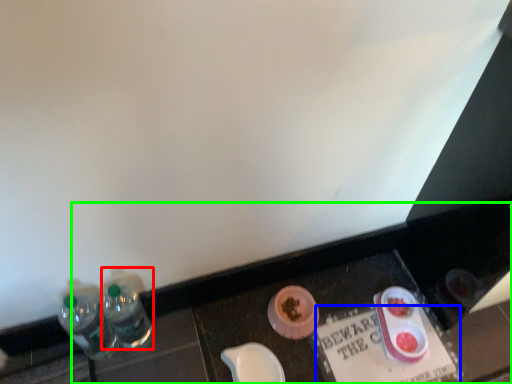
Question: Which object is the closest to the bottle (highlighted by a red box)? Choose among these: writing (highlighted by a blue box) or vanity (highlighted by a green box).

Choices:
 (A) writing
 (B) vanity

Answer: (B)